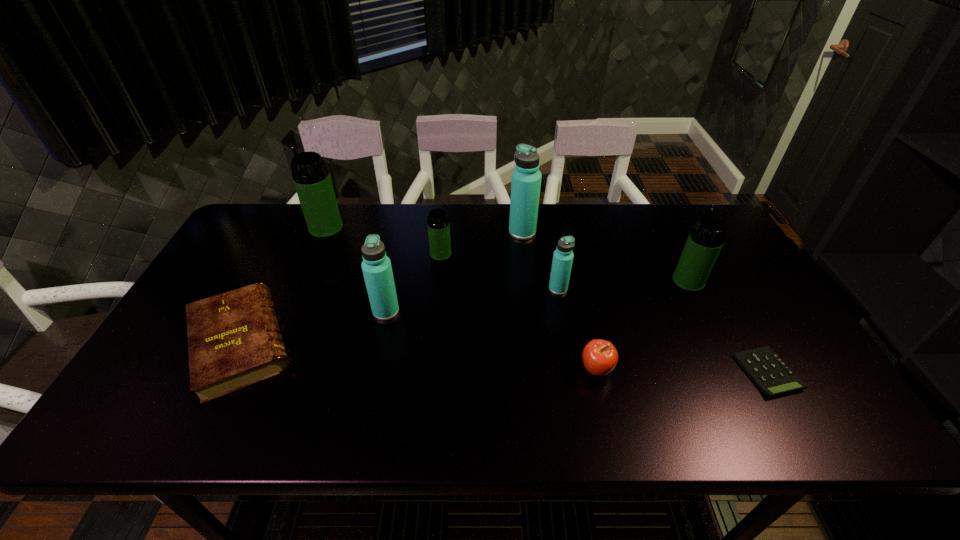
Find the location of `object present at the left edge`. object present at the left edge is located at coordinates (234, 341).

Identify the location of thermos bottle positioned at the right edge. The height and width of the screenshot is (540, 960). (707, 237).

Where is `calculator located in the right edge section of the desktop`? Image resolution: width=960 pixels, height=540 pixels. calculator located in the right edge section of the desktop is located at coordinates (767, 370).

This screenshot has width=960, height=540. Find the location of `object that is at the near left corner`. object that is at the near left corner is located at coordinates (234, 341).

At what (x,y) coordinates should I click in order to perform the action: click on vacant region at the far edge. Please return your answer as a coordinate pair (x, y). The width and height of the screenshot is (960, 540). Looking at the image, I should click on (294, 242).

Find the location of a particular element. free space at the near edge is located at coordinates (659, 418).

At what (x,y) coordinates should I click in order to perform the action: click on free space at the left edge of the desktop. Please return your answer as a coordinate pair (x, y). The height and width of the screenshot is (540, 960). Looking at the image, I should click on [172, 329].

Identify the location of vacant area at the right edge. (782, 352).

The image size is (960, 540). I want to click on blank region between the second thermos bottle from left to right and the smallest aqua thermos bottle, so click(472, 300).

At what (x,y) coordinates should I click in order to perform the action: click on vacant region between the third thermos bottle from left to right and the shortest object. Please return your answer as a coordinate pair (x, y). Image resolution: width=960 pixels, height=540 pixels. Looking at the image, I should click on (604, 313).